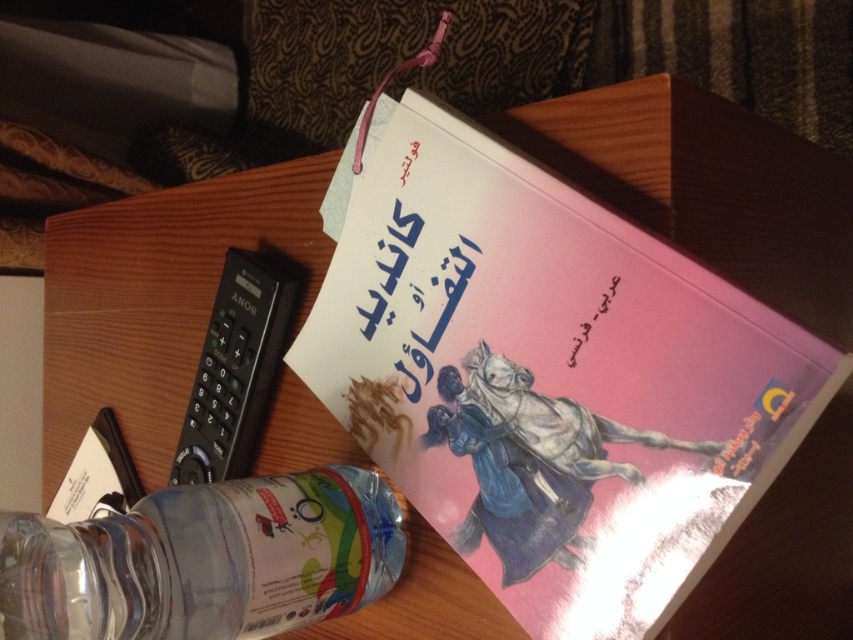
You are looking at a wooden coffee table with a pink matte book at upper center and a black Sony remote control to its left. There is also a point marked at coordinates (x=550, y=380). Where is this point located?

The point at coordinates (x=550, y=380) is on the pink matte book at upper center.

You are looking at the wooden coffee table with the book and the remote control. There are two points marked on the table. One is at coordinates point (x=599, y=572) and the other at point (x=212, y=445). Which of these points is nearer to you?

Point (x=599, y=572) is closer to the viewer than point (x=212, y=445).